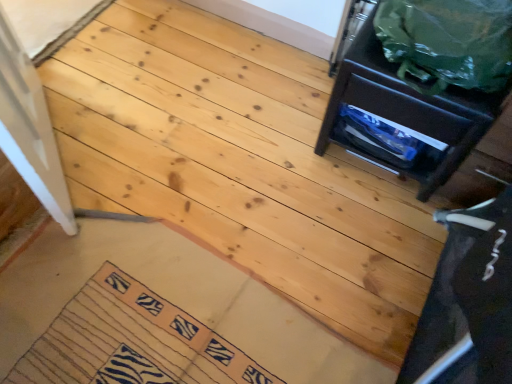
Question: Is zebra-patterned fabric mat at lower left bigger than green plastic bag at upper right?

Choices:
 (A) no
 (B) yes

Answer: (A)

Question: Is zebra-patterned fabric mat at lower left not inside green plastic bag at upper right?

Choices:
 (A) no
 (B) yes

Answer: (B)

Question: From a real-world perspective, is zebra-patterned fabric mat at lower left located higher than green plastic bag at upper right?

Choices:
 (A) yes
 (B) no

Answer: (B)

Question: Does zebra-patterned fabric mat at lower left have a lesser height compared to green plastic bag at upper right?

Choices:
 (A) no
 (B) yes

Answer: (B)

Question: Does zebra-patterned fabric mat at lower left appear on the left side of green plastic bag at upper right?

Choices:
 (A) no
 (B) yes

Answer: (B)

Question: Is zebra-patterned fabric mat at lower left taller than green plastic bag at upper right?

Choices:
 (A) no
 (B) yes

Answer: (A)

Question: Does green plastic bag at upper right have a lesser height compared to matte black drawer at upper right?

Choices:
 (A) yes
 (B) no

Answer: (A)

Question: From the image's perspective, would you say green plastic bag at upper right is positioned over matte black drawer at upper right?

Choices:
 (A) no
 (B) yes

Answer: (B)

Question: Is green plastic bag at upper right thinner than matte black drawer at upper right?

Choices:
 (A) no
 (B) yes

Answer: (B)

Question: Can you confirm if green plastic bag at upper right is bigger than matte black drawer at upper right?

Choices:
 (A) no
 (B) yes

Answer: (A)

Question: Is green plastic bag at upper right behind matte black drawer at upper right?

Choices:
 (A) no
 (B) yes

Answer: (A)

Question: Is green plastic bag at upper right taller than matte black drawer at upper right?

Choices:
 (A) yes
 (B) no

Answer: (B)

Question: Is green plastic bag at upper right located outside zebra-patterned fabric mat at lower left?

Choices:
 (A) yes
 (B) no

Answer: (A)